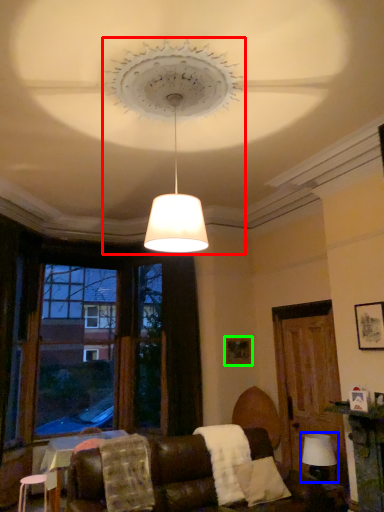
Question: Estimate the real-world distances between objects in this image. Which object is closer to lighting (highlighted by a red box), table lamp (highlighted by a blue box) or picture frame (highlighted by a green box)?

Choices:
 (A) table lamp
 (B) picture frame

Answer: (B)